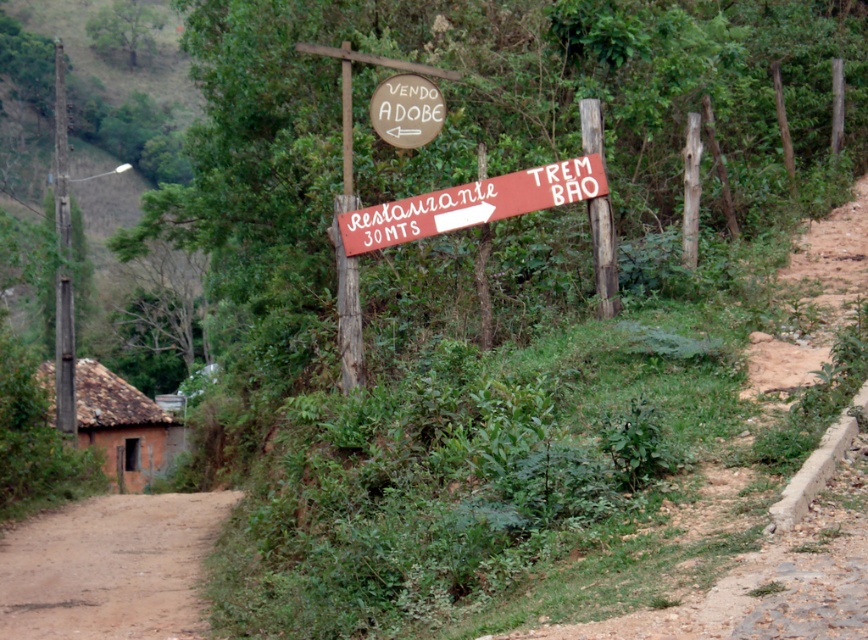
Question: Based on their relative distances, which object is farther from the brown clay hut at lower left?

Choices:
 (A) red wooden sign at center
 (B) wooden post at left
 (C) brown dirt track at lower left
 (D) brown wooden sign at upper center

Answer: (A)

Question: Which point appears farthest from the camera in this image?

Choices:
 (A) (481, 195)
 (B) (91, 422)
 (C) (64, 536)
 (D) (413, 100)

Answer: (B)

Question: From the image, what is the correct spatial relationship of brown dirt track at lower left in relation to brown wooden sign at upper center?

Choices:
 (A) left
 (B) right

Answer: (A)

Question: Is brown clay hut at lower left below brown wooden sign at upper center?

Choices:
 (A) yes
 (B) no

Answer: (A)

Question: Which object is positioned closest to the brown clay hut at lower left?

Choices:
 (A) wooden post at left
 (B) brown dirt track at lower left

Answer: (A)

Question: Can you confirm if red wooden sign at center is positioned to the left of brown clay hut at lower left?

Choices:
 (A) no
 (B) yes

Answer: (A)